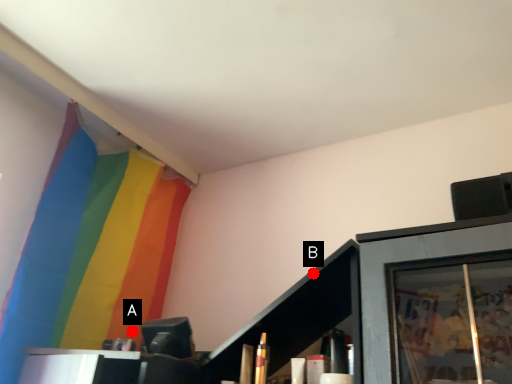
Question: Two points are circled on the image, labeled by A and B beside each circle. Which point appears farthest from the camera in this image?

Choices:
 (A) A is further
 (B) B is further

Answer: (A)